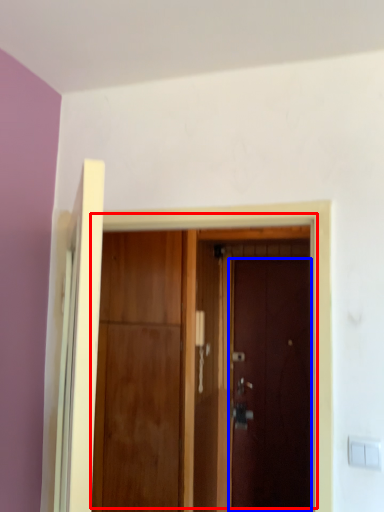
Question: Which object is further to the camera taking this photo, door (highlighted by a red box) or door (highlighted by a blue box)?

Choices:
 (A) door
 (B) door

Answer: (B)